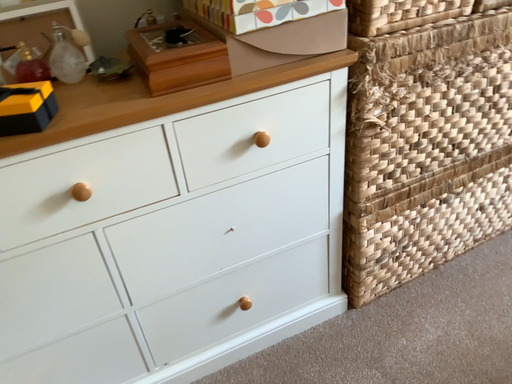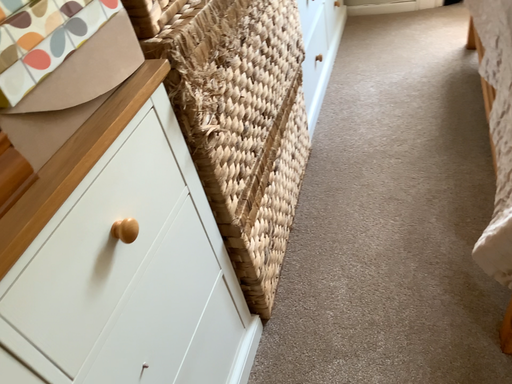
Question: How did the camera likely rotate when shooting the video?

Choices:
 (A) rotated upward
 (B) rotated downward

Answer: (A)